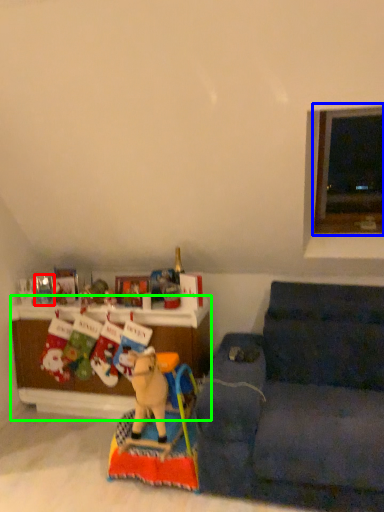
Question: Considering the real-world distances, which object is farthest from toy (highlighted by a red box)? window (highlighted by a blue box) or cabinetry (highlighted by a green box)?

Choices:
 (A) window
 (B) cabinetry

Answer: (A)